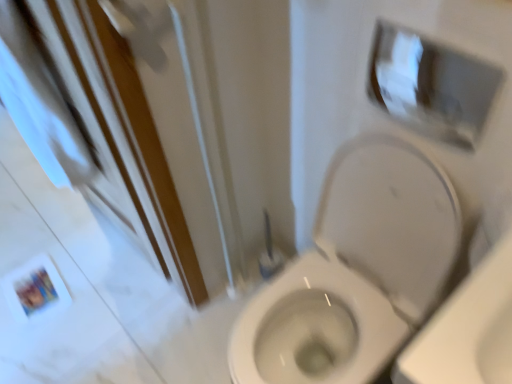
Question: In the image, is white fabric screen door at lower left positioned in front of or behind white glossy medicine cabinet at upper right?

Choices:
 (A) behind
 (B) front

Answer: (B)

Question: From the image's perspective, is white fabric screen door at lower left located above or below white glossy medicine cabinet at upper right?

Choices:
 (A) below
 (B) above

Answer: (A)

Question: Based on their relative distances, which object is farther from the white fabric screen door at lower left?

Choices:
 (A) white glossy medicine cabinet at upper right
 (B) white glossy toilet at center

Answer: (A)

Question: Estimate the real-world distances between objects in this image. Which object is closer to the white glossy toilet at center?

Choices:
 (A) white glossy medicine cabinet at upper right
 (B) white fabric screen door at lower left

Answer: (A)